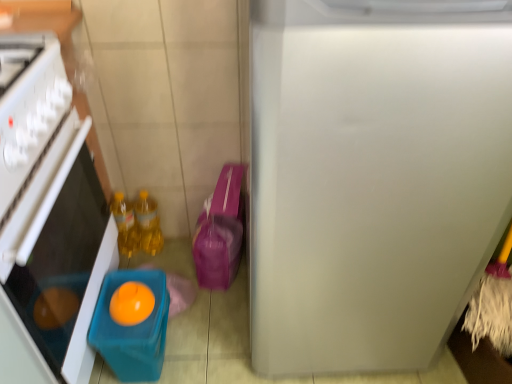
At what (x,y) coordinates should I click in order to perform the action: click on vacant space situated above matte plastic container at lower left (from a real-world perspective). Please return your answer as a coordinate pair (x, y). Image resolution: width=512 pixels, height=384 pixels. Looking at the image, I should click on (134, 310).